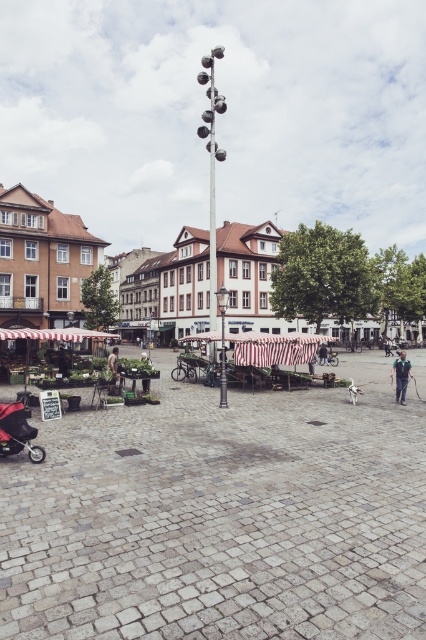
Question: Considering the relative positions of brown wooden market stalls at lower left and green fabric jacket at lower right in the image provided, where is brown wooden market stalls at lower left located with respect to green fabric jacket at lower right?

Choices:
 (A) right
 (B) left

Answer: (B)

Question: Can you confirm if brown wooden market stalls at lower left is thinner than green fabric jacket at lower right?

Choices:
 (A) no
 (B) yes

Answer: (A)

Question: Observing the image, what is the correct spatial positioning of brown wooden market stalls at lower left in reference to green fabric jacket at lower right?

Choices:
 (A) below
 (B) above

Answer: (B)

Question: Which object is farther from the camera taking this photo?

Choices:
 (A) matte black stroller at lower left
 (B) dark blue jeans at center
 (C) brown wooden market stalls at lower left
 (D) green fabric umbrella at lower left

Answer: (C)

Question: Which object is the farthest from the brown wooden market stalls at lower left?

Choices:
 (A) brown stone square at center
 (B) dark blue jeans at center
 (C) green fabric jacket at lower right
 (D) matte black stroller at lower left

Answer: (A)

Question: Which object is closer to the camera taking this photo?

Choices:
 (A) green fabric umbrella at lower left
 (B) brown stone square at center
 (C) matte black stroller at lower left
 (D) brown wooden market stalls at lower left

Answer: (C)